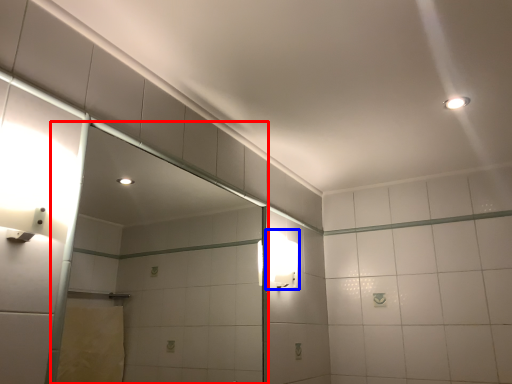
Question: Which object is further to the camera taking this photo, glass door (highlighted by a red box) or light fixture (highlighted by a blue box)?

Choices:
 (A) glass door
 (B) light fixture

Answer: (B)